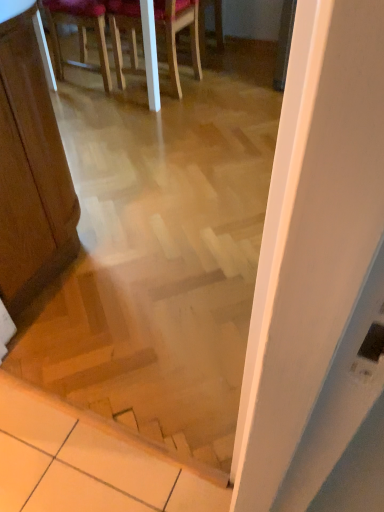
From the picture: Measure the distance between wooden chair at upper center, marked as the 2th chair in a right-to-left arrangement, and camera.

They are 2.57 meters apart.

The height and width of the screenshot is (512, 384). What do you see at coordinates (79, 33) in the screenshot?
I see `wooden chair at upper center, which is the 1th chair in left-to-right order` at bounding box center [79, 33].

This screenshot has width=384, height=512. I want to click on wooden chair at upper center, the 2th chair from the left, so click(176, 33).

The width and height of the screenshot is (384, 512). What do you see at coordinates (176, 33) in the screenshot?
I see `wooden chair at upper center, the first chair when ordered from right to left` at bounding box center [176, 33].

At what (x,y) coordinates should I click in order to perform the action: click on wooden stairs at center. Please return your answer as a coordinate pair (x, y). The width and height of the screenshot is (384, 512). Looking at the image, I should click on (151, 340).

How many degrees apart are the facing directions of wooden chair at upper center, the first chair when ordered from right to left, and wooden chair at upper center, which is the 1th chair in left-to-right order?

177 degrees separate the facing orientations of wooden chair at upper center, the first chair when ordered from right to left, and wooden chair at upper center, which is the 1th chair in left-to-right order.

Considering the relative sizes of wooden chair at upper center, the first chair when ordered from right to left, and wooden chair at upper center, marked as the 2th chair in a right-to-left arrangement, in the image provided, is wooden chair at upper center, the first chair when ordered from right to left, wider than wooden chair at upper center, marked as the 2th chair in a right-to-left arrangement,?

Indeed, wooden chair at upper center, the first chair when ordered from right to left, has a greater width compared to wooden chair at upper center, marked as the 2th chair in a right-to-left arrangement.

From the image's perspective, does wooden chair at upper center, the 2th chair from the left, appear lower than wooden chair at upper center, marked as the 2th chair in a right-to-left arrangement?

Yes.

Is wooden chair at upper center, which is the 1th chair in left-to-right order, completely or partially inside wooden chair at upper center, the 2th chair from the left?

No, wooden chair at upper center, which is the 1th chair in left-to-right order, is located outside of wooden chair at upper center, the 2th chair from the left.

From a real-world perspective, relative to wooden stairs at center, is wooden chair at upper center, the first chair when ordered from right to left, vertically above or below?

From a real-world perspective, wooden chair at upper center, the first chair when ordered from right to left, is physically below wooden stairs at center.

Is wooden chair at upper center, the first chair when ordered from right to left, surrounding wooden stairs at center?

No, wooden chair at upper center, the first chair when ordered from right to left, does not contain wooden stairs at center.

Locate an element on the screen. The image size is (384, 512). the 1st chair behind the wooden stairs at center is located at coordinates (176, 33).

How far apart are wooden chair at upper center, the 2th chair from the left, and wooden stairs at center?

They are 1.63 meters apart.

Looking at this image, considering the positions of objects wooden chair at upper center, which is the 1th chair in left-to-right order, and wooden stairs at center in the image provided, who is more to the left, wooden chair at upper center, which is the 1th chair in left-to-right order, or wooden stairs at center?

From the viewer's perspective, wooden chair at upper center, which is the 1th chair in left-to-right order, appears more on the left side.

Which object is thinner, wooden chair at upper center, which is the 1th chair in left-to-right order, or wooden stairs at center?

wooden stairs at center.

Based on the photo, are wooden chair at upper center, which is the 1th chair in left-to-right order, and wooden stairs at center far apart?

Yes.

Is wooden chair at upper center, which is the 1th chair in left-to-right order, aimed at wooden stairs at center?

No.

Which is closer to the camera, (99,14) or (170,17)?

The point (170,17) is closer.

Between wooden chair at upper center, which is the 1th chair in left-to-right order, and wooden chair at upper center, the first chair when ordered from right to left, which one is positioned behind?

Positioned behind is wooden chair at upper center, which is the 1th chair in left-to-right order.

Between wooden chair at upper center, which is the 1th chair in left-to-right order, and wooden chair at upper center, the 2th chair from the left, which one has larger size?

Bigger between the two is wooden chair at upper center, the 2th chair from the left.

Would you say wooden chair at upper center, which is the 1th chair in left-to-right order, is outside wooden chair at upper center, the 2th chair from the left?

wooden chair at upper center, which is the 1th chair in left-to-right order, is positioned outside wooden chair at upper center, the 2th chair from the left.

Who is more distant, wooden stairs at center or wooden chair at upper center, marked as the 2th chair in a right-to-left arrangement?

→ wooden chair at upper center, marked as the 2th chair in a right-to-left arrangement, is further from the camera.

Which object is positioned more to the left, wooden stairs at center or wooden chair at upper center, marked as the 2th chair in a right-to-left arrangement?

wooden chair at upper center, marked as the 2th chair in a right-to-left arrangement.

Between point (171, 401) and point (105, 50), which one is positioned in front?

The point (171, 401) is closer to the camera.

From a real-world perspective, is wooden stairs at center below wooden chair at upper center, marked as the 2th chair in a right-to-left arrangement?

No, from a real-world perspective, wooden stairs at center is not beneath wooden chair at upper center, marked as the 2th chair in a right-to-left arrangement.

Is wooden stairs at center to the left of wooden chair at upper center, the first chair when ordered from right to left, from the viewer's perspective?

Yes, wooden stairs at center is to the left of wooden chair at upper center, the first chair when ordered from right to left.

In the scene shown: In terms of size, does wooden stairs at center appear bigger or smaller than wooden chair at upper center, the first chair when ordered from right to left?

Considering their sizes, wooden stairs at center takes up less space than wooden chair at upper center, the first chair when ordered from right to left.

There is a wooden stairs at center. Where is `the 1st chair above it (from the image's perspective)`? The width and height of the screenshot is (384, 512). the 1st chair above it (from the image's perspective) is located at coordinates (176, 33).

The image size is (384, 512). I want to click on chair that appears behind the wooden chair at upper center, the first chair when ordered from right to left, so click(x=79, y=33).

Find the location of a particular element. stairwell below the wooden chair at upper center, the first chair when ordered from right to left (from the image's perspective) is located at coordinates (151, 340).

Based on their spatial positions, is wooden stairs at center or wooden chair at upper center, the 2th chair from the left, further from wooden chair at upper center, which is the 1th chair in left-to-right order?

wooden stairs at center.

Based on their spatial positions, is wooden chair at upper center, which is the 1th chair in left-to-right order, or wooden chair at upper center, the first chair when ordered from right to left, further from wooden stairs at center?

wooden chair at upper center, which is the 1th chair in left-to-right order, lies further to wooden stairs at center than the other object.

Estimate the real-world distances between objects in this image. Which object is further from wooden chair at upper center, the 2th chair from the left, wooden chair at upper center, which is the 1th chair in left-to-right order, or wooden stairs at center?

The object further to wooden chair at upper center, the 2th chair from the left, is wooden stairs at center.

Estimate the real-world distances between objects in this image. Which object is further from wooden chair at upper center, the first chair when ordered from right to left, wooden stairs at center or wooden chair at upper center, marked as the 2th chair in a right-to-left arrangement?

wooden stairs at center is further to wooden chair at upper center, the first chair when ordered from right to left.

Looking at the image, which one is located further to wooden stairs at center, wooden chair at upper center, the first chair when ordered from right to left, or wooden chair at upper center, marked as the 2th chair in a right-to-left arrangement?

wooden chair at upper center, marked as the 2th chair in a right-to-left arrangement, is further to wooden stairs at center.

From the image, which object appears to be nearer to wooden chair at upper center, marked as the 2th chair in a right-to-left arrangement, wooden chair at upper center, the 2th chair from the left, or wooden stairs at center?

wooden chair at upper center, the 2th chair from the left, is positioned closer to the anchor wooden chair at upper center, marked as the 2th chair in a right-to-left arrangement.

Where is `chair between wooden stairs at center and wooden chair at upper center, marked as the 2th chair in a right-to-left arrangement, along the z-axis`? chair between wooden stairs at center and wooden chair at upper center, marked as the 2th chair in a right-to-left arrangement, along the z-axis is located at coordinates (176, 33).